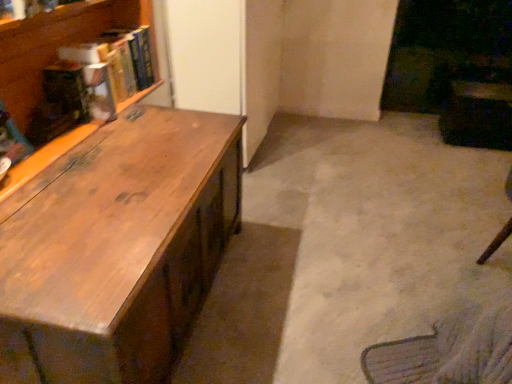
Question: From the image's perspective, is wooden desk at left above hardcover book at upper left, which is the 2th book in back-to-front order?

Choices:
 (A) no
 (B) yes

Answer: (A)

Question: Can you see wooden desk at left touching hardcover book at upper left, the 1th book in the front-to-back sequence?

Choices:
 (A) no
 (B) yes

Answer: (A)

Question: Can you confirm if wooden desk at left is thinner than hardcover book at upper left, the 1th book in the front-to-back sequence?

Choices:
 (A) yes
 (B) no

Answer: (B)

Question: Is hardcover book at upper left, the 1th book in the front-to-back sequence, at the back of wooden desk at left?

Choices:
 (A) no
 (B) yes

Answer: (A)

Question: Can you confirm if wooden desk at left is positioned to the left of hardcover book at upper left, which is the 2th book in back-to-front order?

Choices:
 (A) no
 (B) yes

Answer: (A)

Question: Does wooden desk at left have a smaller size compared to hardcover book at upper left, the 1th book in the front-to-back sequence?

Choices:
 (A) yes
 (B) no

Answer: (B)

Question: From the image's perspective, does wooden desk at left appear higher than hardcover book at upper left, which is counted as the second book, starting from the front?

Choices:
 (A) yes
 (B) no

Answer: (B)

Question: Can you confirm if wooden desk at left is shorter than hardcover book at upper left, which is the first book in back-to-front order?

Choices:
 (A) yes
 (B) no

Answer: (B)

Question: Considering the relative sizes of wooden desk at left and hardcover book at upper left, which is the first book in back-to-front order, in the image provided, is wooden desk at left wider than hardcover book at upper left, which is the first book in back-to-front order,?

Choices:
 (A) no
 (B) yes

Answer: (B)

Question: Considering the relative positions of wooden desk at left and hardcover book at upper left, which is the first book in back-to-front order, in the image provided, is wooden desk at left in front of hardcover book at upper left, which is the first book in back-to-front order,?

Choices:
 (A) yes
 (B) no

Answer: (A)

Question: Could you tell me if wooden desk at left is turned towards hardcover book at upper left, which is the first book in back-to-front order?

Choices:
 (A) yes
 (B) no

Answer: (B)

Question: Can you confirm if wooden desk at left is taller than hardcover book at upper left, which is the first book in back-to-front order?

Choices:
 (A) yes
 (B) no

Answer: (A)

Question: Can you confirm if hardcover book at upper left, which is the 2th book in back-to-front order, is shorter than hardcover book at upper left, which is the first book in back-to-front order?

Choices:
 (A) no
 (B) yes

Answer: (B)